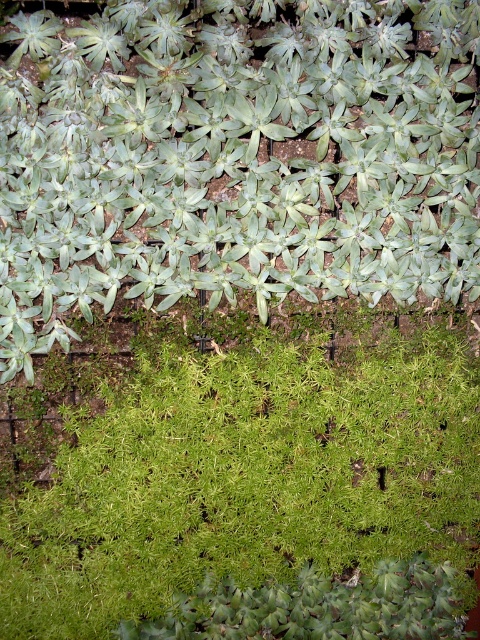
The height and width of the screenshot is (640, 480). Describe the element at coordinates (235, 157) in the screenshot. I see `green leafy plant at upper center` at that location.

This screenshot has width=480, height=640. What do you see at coordinates (235, 157) in the screenshot?
I see `green leafy plant at upper center` at bounding box center [235, 157].

Where is `green leafy plant at upper center`? This screenshot has height=640, width=480. green leafy plant at upper center is located at coordinates (235, 157).